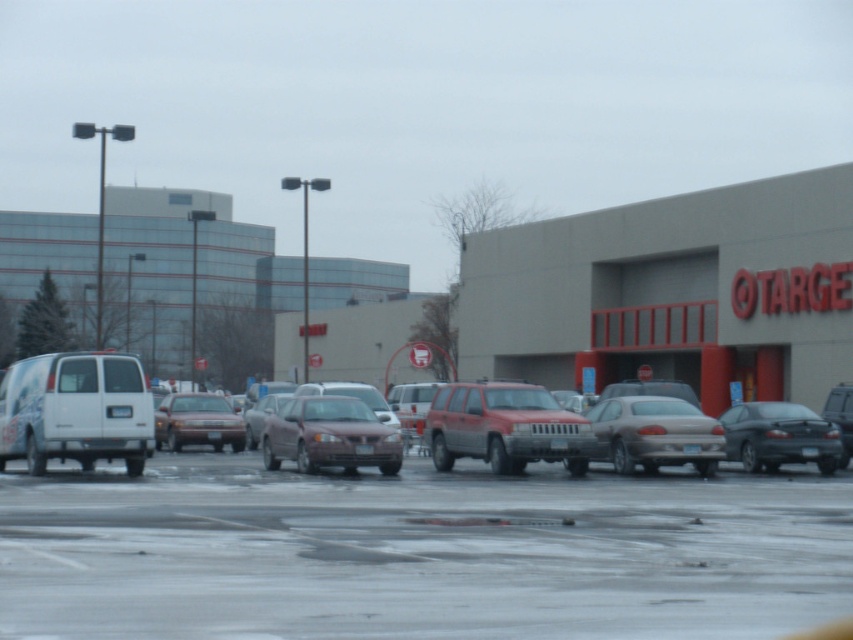
Between point (291, 442) and point (767, 444), which one is positioned in front?

Point (291, 442) is more forward.

Does matte maroon sedan at center appear over dark gray metallic sedan at right?

Correct, matte maroon sedan at center is located above dark gray metallic sedan at right.

Is point (343, 470) more distant than point (747, 442)?

No.

Identify the location of matte maroon sedan at center. (329, 435).

Can you confirm if red matte suv at center is shorter than dark gray metallic sedan at right?

In fact, red matte suv at center may be taller than dark gray metallic sedan at right.

Is red matte suv at center above dark gray metallic sedan at right?

Yes.

Is point (431, 403) closer to viewer compared to point (756, 429)?

That is False.

The height and width of the screenshot is (640, 853). In order to click on red matte suv at center in this screenshot , I will do `click(503, 428)`.

This screenshot has width=853, height=640. What do you see at coordinates (654, 435) in the screenshot? I see `gold metallic sedan at center` at bounding box center [654, 435].

This screenshot has width=853, height=640. In order to click on gold metallic sedan at center in this screenshot , I will do `click(654, 435)`.